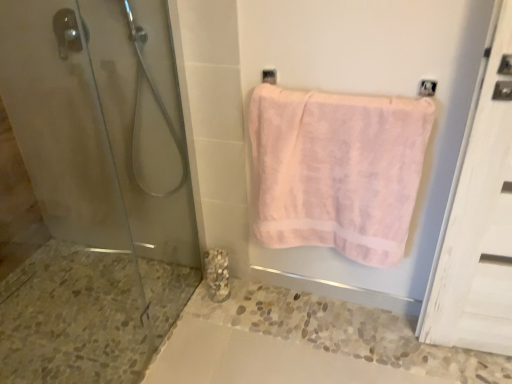
In order to click on unoccupied region to the right of transparent glass shower door at left in this screenshot , I will do `click(254, 348)`.